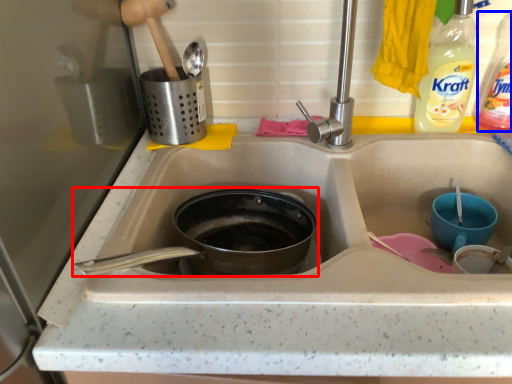
Question: Which object appears closest to the camera in this image, frying pan (highlighted by a red box) or bottle (highlighted by a blue box)?

Choices:
 (A) frying pan
 (B) bottle

Answer: (B)